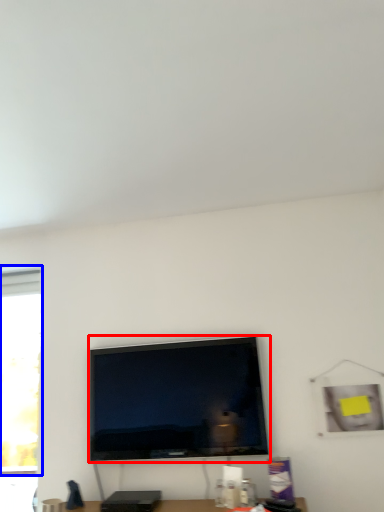
Question: Which object is further to the camera taking this photo, television (highlighted by a red box) or window (highlighted by a blue box)?

Choices:
 (A) television
 (B) window

Answer: (B)